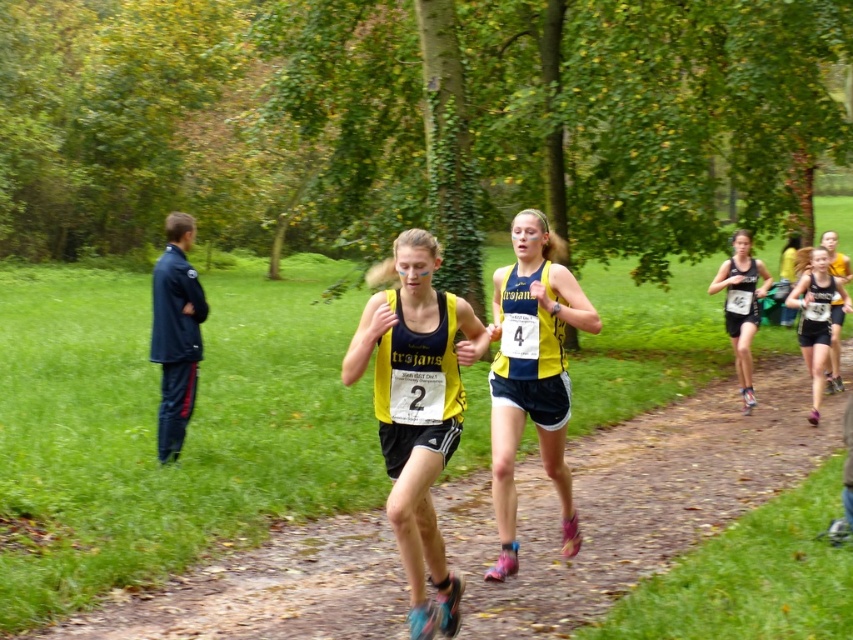
Question: Where is yellow fabric shorts at center located in relation to matte yellow tank top at center in the image?

Choices:
 (A) above
 (B) below

Answer: (B)

Question: Among these points, which one is nearest to the camera?

Choices:
 (A) (418, 500)
 (B) (824, 269)
 (C) (548, 595)
 (D) (758, 308)

Answer: (A)

Question: Is yellow fabric runner at center bigger than yellow matte tank top at center?

Choices:
 (A) yes
 (B) no

Answer: (A)

Question: Does yellow fabric runner at center appear under yellow matte tank top at center?

Choices:
 (A) yes
 (B) no

Answer: (A)

Question: Which of these objects is positioned farthest from the yellow fabric runner at center?

Choices:
 (A) matte black tank top at right
 (B) matte yellow tank top at center
 (C) yellow fabric shorts at center
 (D) yellow matte tank top at center

Answer: (A)

Question: Among these objects, which one is farthest from the camera?

Choices:
 (A) yellow fabric runner at center
 (B) yellow fabric shorts at center

Answer: (B)